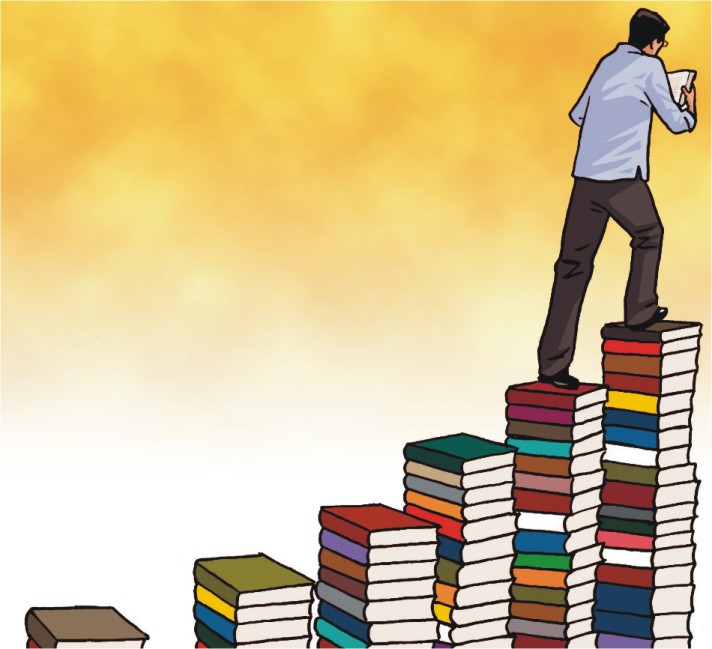
At what (x,y) coordinates should I click in order to perform the action: click on stack of books. Please return your answer as a coordinate pair (x, y). The height and width of the screenshot is (649, 712). Looking at the image, I should click on (78, 624), (275, 592), (374, 561), (471, 524), (553, 502), (634, 479).